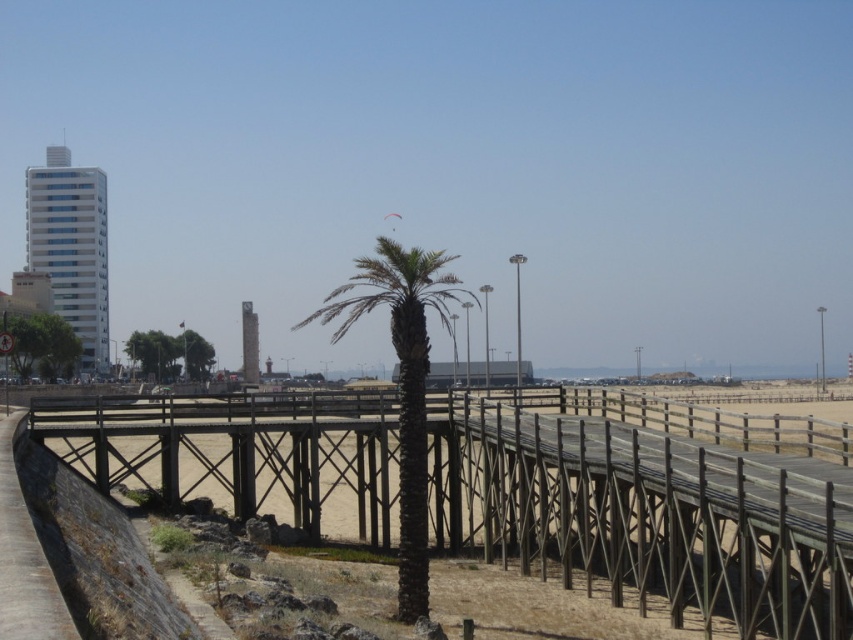
Question: Which point is farther from the camera taking this photo?

Choices:
 (A) (44, 586)
 (B) (409, 413)
 (C) (265, 477)

Answer: (C)

Question: Which of the following is the farthest from the observer?

Choices:
 (A) (416, 509)
 (B) (230, 451)

Answer: (B)

Question: Does dark brown wood palm tree at center have a smaller size compared to brown wooden path at lower left?

Choices:
 (A) no
 (B) yes

Answer: (A)

Question: Which object is farther from the camera taking this photo?

Choices:
 (A) brown wooden path at lower left
 (B) dark brown wood palm tree at center
 (C) brown wooden bridge at center

Answer: (B)

Question: Is brown wooden bridge at center below dark brown wood palm tree at center?

Choices:
 (A) yes
 (B) no

Answer: (A)

Question: Does dark brown wood palm tree at center appear under brown wooden path at lower left?

Choices:
 (A) no
 (B) yes

Answer: (A)